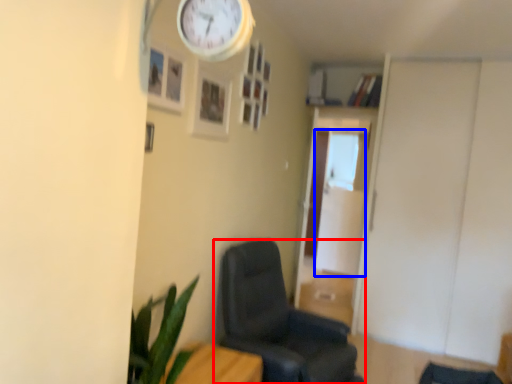
Question: Which object is closer to the camera taking this photo, chair (highlighted by a red box) or glass door (highlighted by a blue box)?

Choices:
 (A) chair
 (B) glass door

Answer: (A)